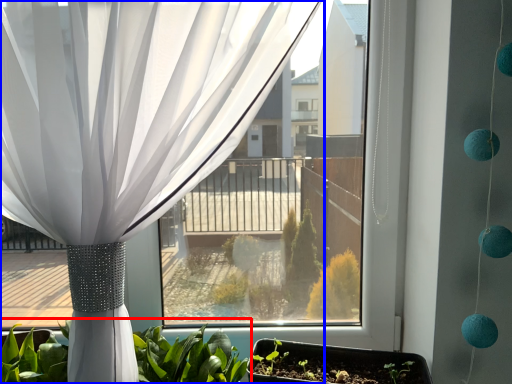
Question: Among these objects, which one is nearest to the camera, houseplant (highlighted by a red box) or curtain (highlighted by a blue box)?

Choices:
 (A) houseplant
 (B) curtain

Answer: (B)